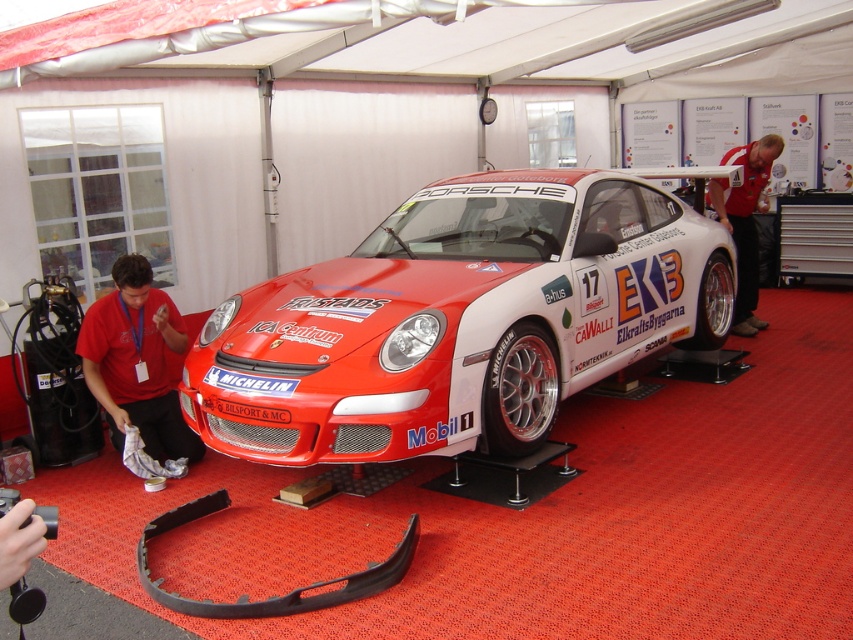
Does shiny red racing car at center have a greater width compared to matte red shirt at lower left?

Correct, the width of shiny red racing car at center exceeds that of matte red shirt at lower left.

Does shiny red racing car at center appear over matte red shirt at lower left?

Correct, shiny red racing car at center is located above matte red shirt at lower left.

Is point (550, 296) farther from viewer compared to point (105, 324)?

No.

The image size is (853, 640). Identify the location of shiny red racing car at center. (459, 321).

In the scene shown: Can you confirm if shiny red racing car at center is positioned to the right of red fabric shirt at upper right?

In fact, shiny red racing car at center is to the left of red fabric shirt at upper right.

Is shiny red racing car at center bigger than red fabric shirt at upper right?

Correct, shiny red racing car at center is larger in size than red fabric shirt at upper right.

Is point (643, 184) closer to camera compared to point (753, 323)?

Yes, it is in front of point (753, 323).

Where is `shiny red racing car at center`? This screenshot has width=853, height=640. shiny red racing car at center is located at coordinates coord(459,321).

Is matte red shirt at lower left to the left of red fabric shirt at upper right from the viewer's perspective?

Indeed, matte red shirt at lower left is positioned on the left side of red fabric shirt at upper right.

Who is positioned more to the right, matte red shirt at lower left or red fabric shirt at upper right?

Positioned to the right is red fabric shirt at upper right.

Does point (84, 348) come in front of point (743, 220)?

Yes, point (84, 348) is closer to viewer.

This screenshot has width=853, height=640. I want to click on matte red shirt at lower left, so click(136, 362).